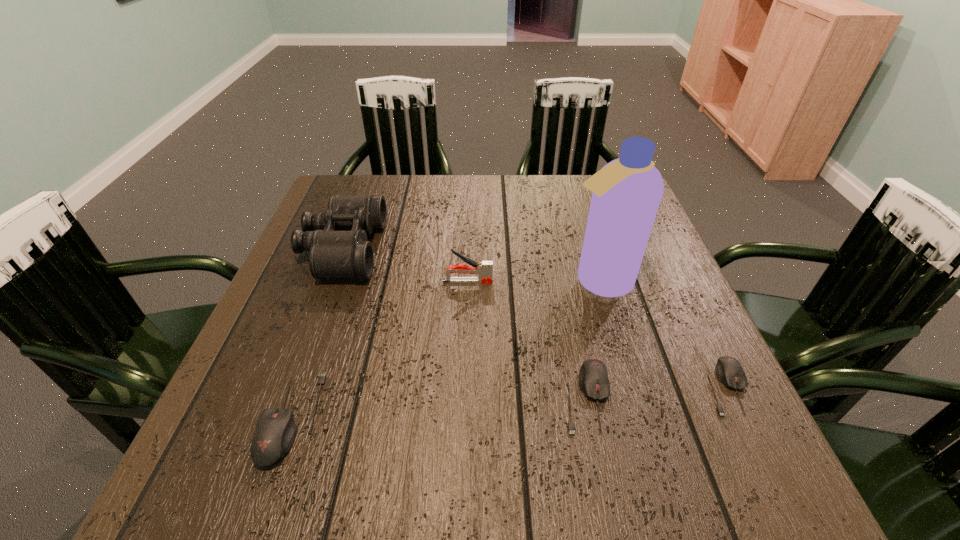
The width and height of the screenshot is (960, 540). I want to click on object situated at the far left corner, so click(x=337, y=240).

Locate an element on the screen. object situated at the near left corner is located at coordinates (275, 432).

The image size is (960, 540). Find the location of `object present at the near right corner`. object present at the near right corner is located at coordinates (729, 371).

I want to click on free spot at the far edge of the desktop, so click(x=566, y=175).

The image size is (960, 540). What are the coordinates of `free space at the far left corner of the desktop` in the screenshot? It's located at (345, 183).

Locate an element on the screen. The height and width of the screenshot is (540, 960). vacant space at the near left corner of the desktop is located at coordinates (293, 393).

In the image, there is a desktop. Where is `vacant space at the near right corner`? vacant space at the near right corner is located at coordinates (658, 400).

Where is `free point between the rightmost object and the second tallest mouse`? The image size is (960, 540). free point between the rightmost object and the second tallest mouse is located at coordinates (657, 392).

Locate an element on the screen. blank region between the stapler and the binoculars is located at coordinates (405, 265).

At what (x,y) coordinates should I click in order to perform the action: click on free space between the tallest object and the second mouse from left to right. Please return your answer as a coordinate pair (x, y). This screenshot has width=960, height=540. Looking at the image, I should click on (592, 339).